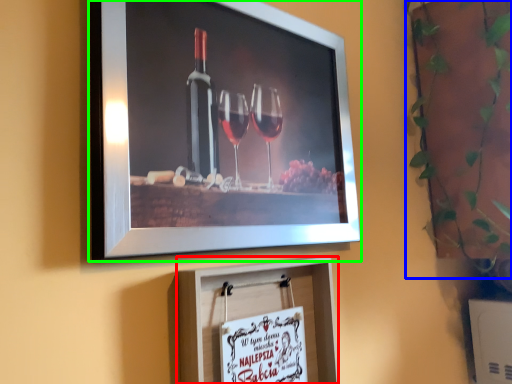
Question: Which object is the farthest from picture frame (highlighted by a red box)? Choose among these: plant (highlighted by a blue box) or picture frame (highlighted by a green box).

Choices:
 (A) plant
 (B) picture frame

Answer: (A)